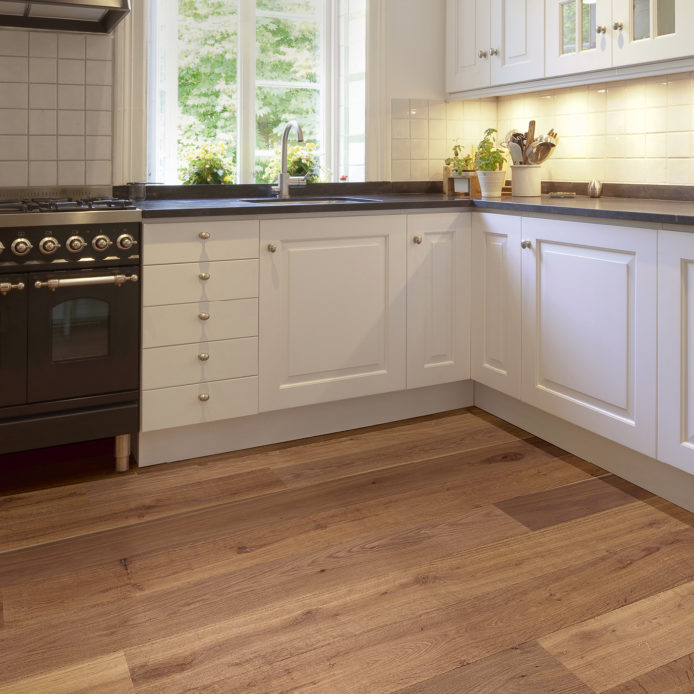
Image resolution: width=694 pixels, height=694 pixels. What are the coordinates of `white pot` in the screenshot? It's located at (527, 185), (489, 187).